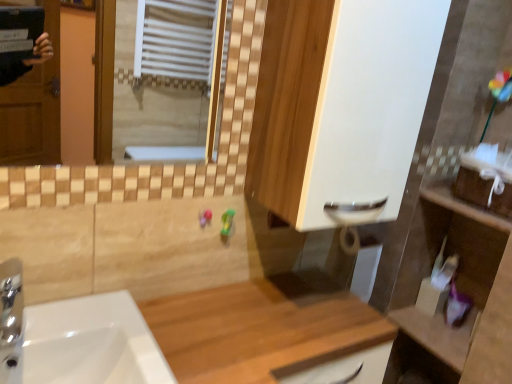
Question: Are wooden at center and white matte cabinet at center located far from each other?

Choices:
 (A) no
 (B) yes

Answer: (A)

Question: Does wooden at center appear on the left side of white matte cabinet at center?

Choices:
 (A) yes
 (B) no

Answer: (A)

Question: Can you confirm if wooden at center is positioned to the right of white matte cabinet at center?

Choices:
 (A) no
 (B) yes

Answer: (A)

Question: From a real-world perspective, is wooden at center positioned over white matte cabinet at center based on gravity?

Choices:
 (A) no
 (B) yes

Answer: (A)

Question: Is wooden at center completely or partially outside of white matte cabinet at center?

Choices:
 (A) yes
 (B) no

Answer: (A)

Question: Considering the relative positions of wooden shelf at right and chrome metallic tap at lower left in the image provided, is wooden shelf at right to the left or to the right of chrome metallic tap at lower left?

Choices:
 (A) left
 (B) right

Answer: (B)

Question: Is wooden shelf at right bigger or smaller than chrome metallic tap at lower left?

Choices:
 (A) big
 (B) small

Answer: (A)

Question: From their relative heights in the image, would you say wooden shelf at right is taller or shorter than chrome metallic tap at lower left?

Choices:
 (A) tall
 (B) short

Answer: (A)

Question: From the image's perspective, relative to chrome metallic tap at lower left, is wooden shelf at right above or below?

Choices:
 (A) above
 (B) below

Answer: (B)

Question: Considering the positions of point tap(406, 342) and point tap(373, 157), is point tap(406, 342) closer or farther from the camera than point tap(373, 157)?

Choices:
 (A) farther
 (B) closer

Answer: (A)

Question: In terms of size, does wooden shelf at right appear bigger or smaller than white matte cabinet at center?

Choices:
 (A) small
 (B) big

Answer: (B)

Question: Is wooden shelf at right situated inside white matte cabinet at center or outside?

Choices:
 (A) outside
 (B) inside

Answer: (A)

Question: Relative to white matte cabinet at center, is wooden shelf at right in front or behind?

Choices:
 (A) behind
 (B) front

Answer: (A)

Question: Is wooden shelf at right spatially inside wooden at center, or outside of it?

Choices:
 (A) inside
 (B) outside

Answer: (B)

Question: From the image's perspective, is wooden shelf at right located above or below wooden at center?

Choices:
 (A) below
 (B) above

Answer: (B)